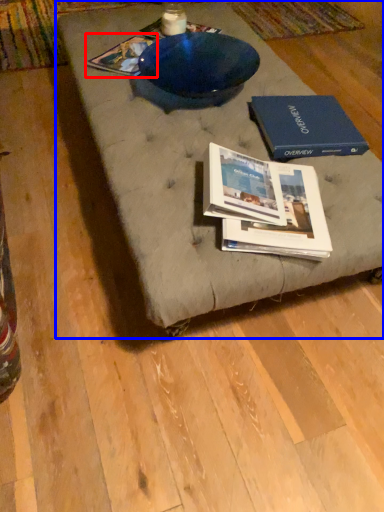
Question: Which of the following is the closest to the observer, book (highlighted by a red box) or coffee table (highlighted by a blue box)?

Choices:
 (A) book
 (B) coffee table

Answer: (B)